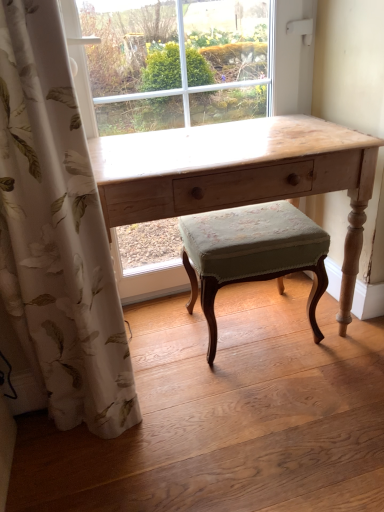
Question: Is white floral fabric curtain at left taller or shorter than light wood desk at center?

Choices:
 (A) tall
 (B) short

Answer: (A)

Question: Is white floral fabric curtain at left in front of or behind light wood desk at center in the image?

Choices:
 (A) front
 (B) behind

Answer: (A)

Question: Which of these objects is positioned closest to the white floral fabric curtain at left?

Choices:
 (A) light wood desk at center
 (B) green fabric stool at center

Answer: (A)

Question: Which object is positioned closest to the white floral fabric curtain at left?

Choices:
 (A) green fabric stool at center
 (B) light wood desk at center

Answer: (B)